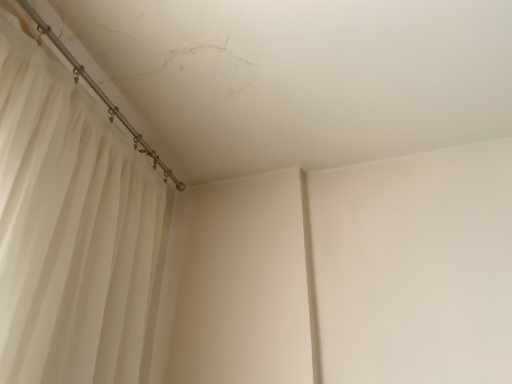
The image size is (512, 384). What do you see at coordinates (100, 94) in the screenshot?
I see `metallic curtain rod at upper left` at bounding box center [100, 94].

Locate an element on the screen. metallic curtain rod at upper left is located at coordinates (100, 94).

What is the approximate width of metallic curtain rod at upper left?

1.71 inches.

I want to click on metallic curtain rod at upper left, so click(x=100, y=94).